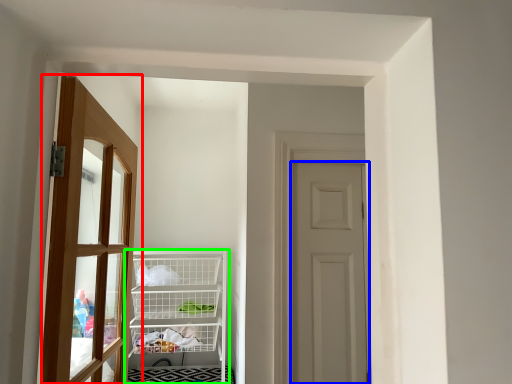
Question: Based on their relative distances, which object is nearer to door (highlighted by a red box)? Choose from door (highlighted by a blue box) and shelf (highlighted by a green box).

Choices:
 (A) door
 (B) shelf

Answer: (B)